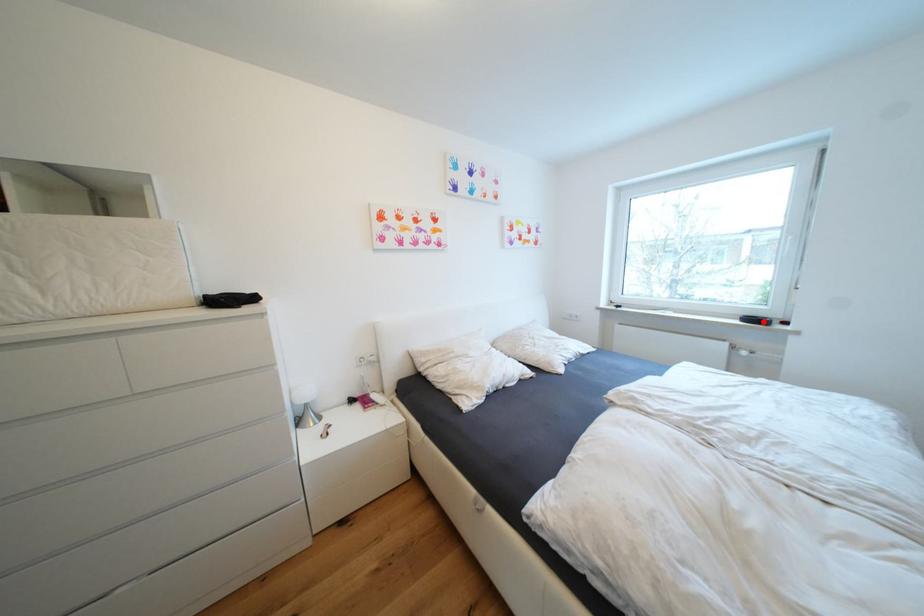
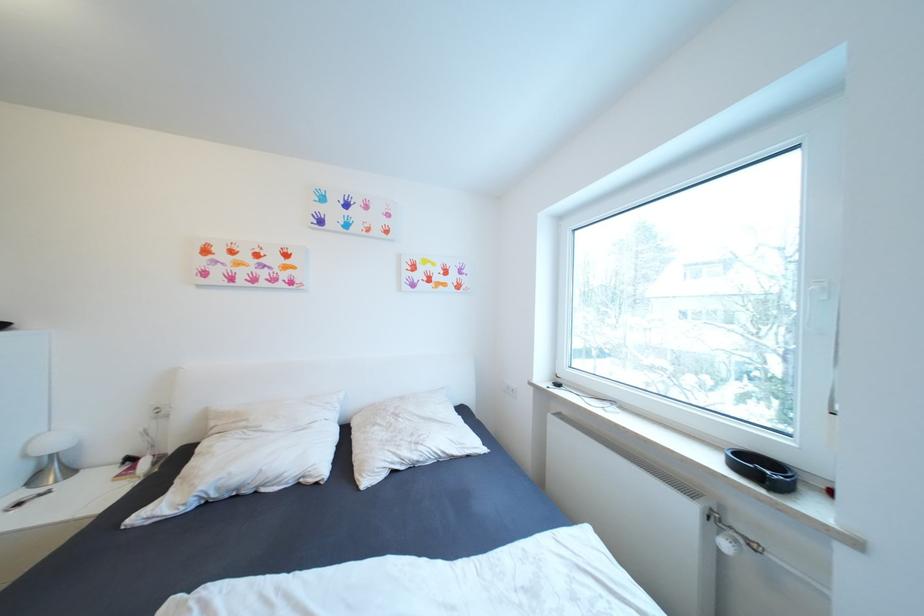
Locate, in the second image, the point that corresponds to the highlighted location in the first image.

(769, 471)